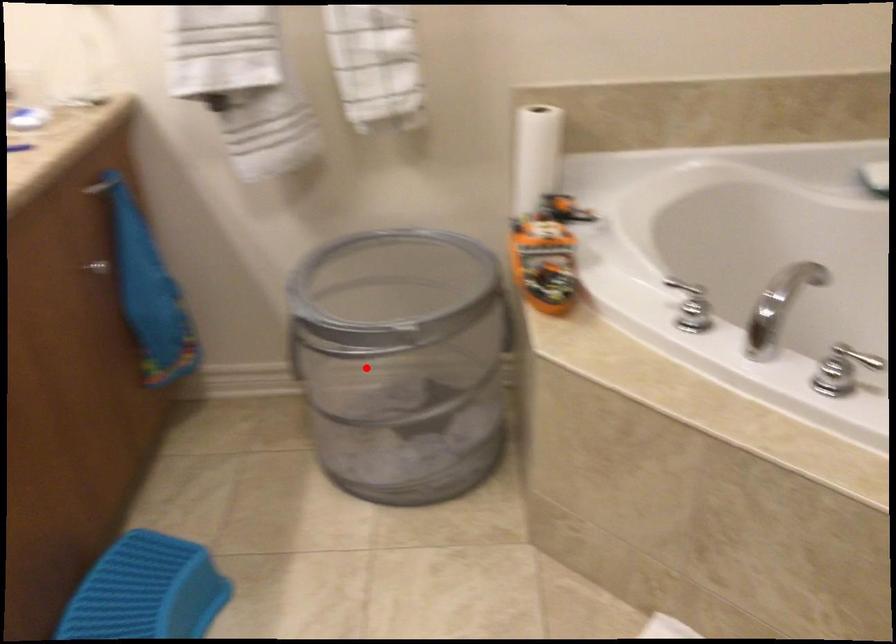
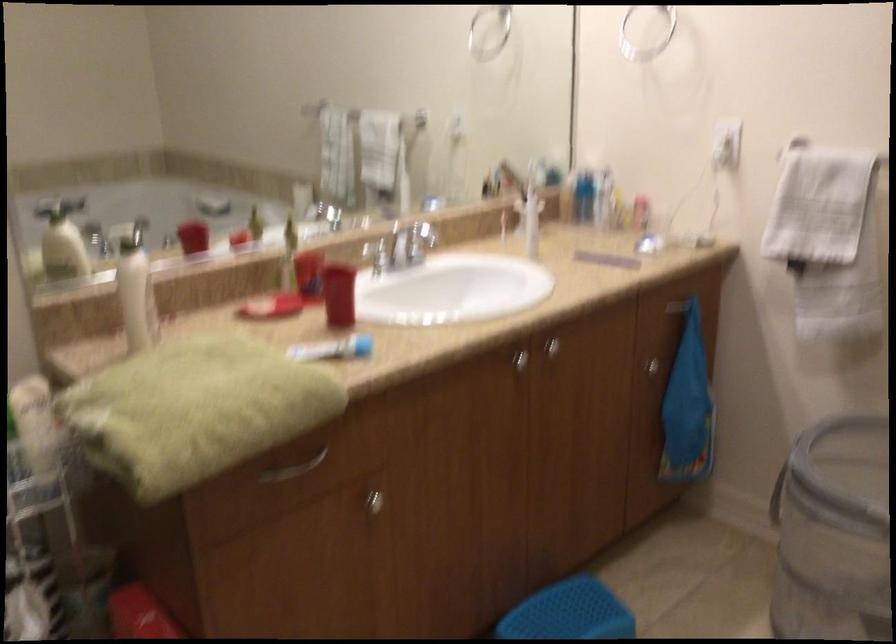
Locate, in the second image, the point that corresponds to the highlighted location in the first image.

(833, 533)